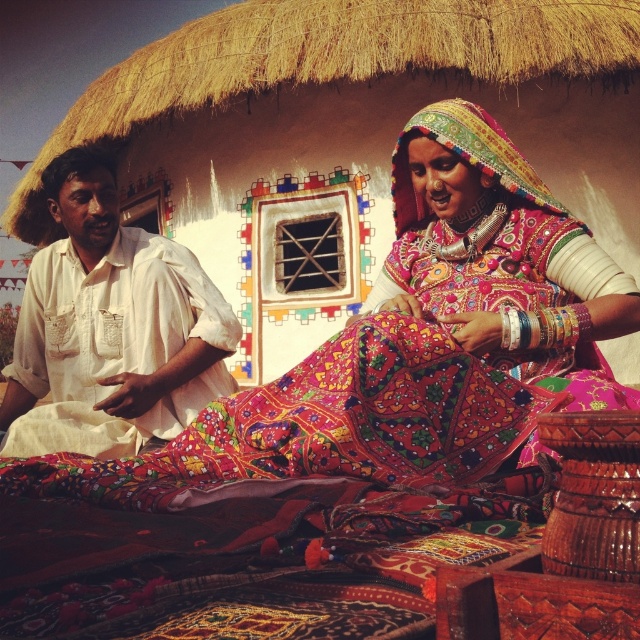
You are an anthropologist studying traditional crafts and you see the embroidered fabric dress at center in the scene. Can you determine its exact location in terms of coordinates?

Answer: The embroidered fabric dress at center is located at coordinates point (412, 346).

You are standing in front of the vibrant rural scene. There is a point marked at coordinates point (246, 429). Can you reach this point without moving closer than 10 meters from where you are standing?

The point (246, 429) is 10.67 meters away from the viewer, so you cannot reach it without moving closer than 10 meters because it is slightly farther away than that distance.

You are a tailor who needs to determine which garment requires more fabric to make between the embroidered fabric dress at center and the white cotton shirt at left. Based on their sizes, which one would need more fabric?

The embroidered fabric dress at center is larger in size than the white cotton shirt at left, so it would require more fabric to make.